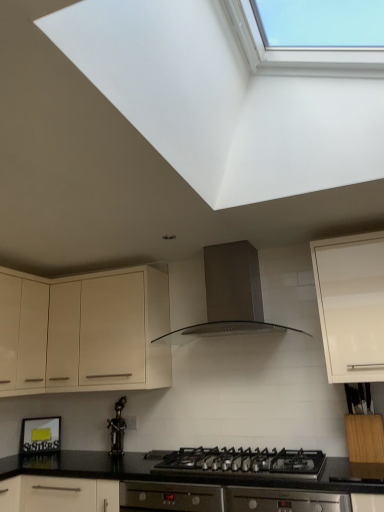
What is the approximate width of matte cream cabinet at upper left, positioned as the 1th cabinetry in back-to-front order?

It is 15.52 inches.

Image resolution: width=384 pixels, height=512 pixels. What do you see at coordinates (244, 462) in the screenshot?
I see `black matte gas stove at center` at bounding box center [244, 462].

What do you see at coordinates (117, 429) in the screenshot?
I see `bronze statue at center` at bounding box center [117, 429].

Find the location of `matte cream cabinet at upper left, positioned as the 1th cabinetry in back-to-front order`. matte cream cabinet at upper left, positioned as the 1th cabinetry in back-to-front order is located at coordinates (83, 332).

Is satin silver range hood at center not near bronze statue at center?

satin silver range hood at center is far away from bronze statue at center.

Is satin silver range hood at center taller or shorter than bronze statue at center?

Considering their sizes, satin silver range hood at center has more height than bronze statue at center.

Which is behind, point (220, 267) or point (122, 397)?

The point (122, 397) is farther.

Which of these two, satin silver range hood at center or matte cream cabinet at upper left, marked as the 1th cabinetry in a left-to-right arrangement, stands taller?

Standing taller between the two is matte cream cabinet at upper left, marked as the 1th cabinetry in a left-to-right arrangement.

Considering the relative sizes of satin silver range hood at center and matte cream cabinet at upper left, the 2th cabinetry viewed from the front, in the image provided, is satin silver range hood at center wider than matte cream cabinet at upper left, the 2th cabinetry viewed from the front,?

Yes.

Can we say satin silver range hood at center lies outside matte cream cabinet at upper left, positioned as the 1th cabinetry in back-to-front order?

Yes, satin silver range hood at center is outside of matte cream cabinet at upper left, positioned as the 1th cabinetry in back-to-front order.

In the scene shown: Between satin silver range hood at center and matte cream cabinet at upper left, marked as the 1th cabinetry in a left-to-right arrangement, which one is positioned in front?

satin silver range hood at center is in front.

Is matte cream cabinet at upper left, the 2th cabinetry viewed from the front, completely or partially inside bronze statue at center?

No, matte cream cabinet at upper left, the 2th cabinetry viewed from the front, is not a part of bronze statue at center.

Considering the sizes of objects bronze statue at center and matte cream cabinet at upper left, positioned as the 1th cabinetry in back-to-front order, in the image provided, who is smaller, bronze statue at center or matte cream cabinet at upper left, positioned as the 1th cabinetry in back-to-front order,?

Smaller between the two is bronze statue at center.

In the scene shown: Could you tell me if bronze statue at center is facing matte cream cabinet at upper left, the 2th cabinetry viewed from the front?

No, bronze statue at center is not oriented towards matte cream cabinet at upper left, the 2th cabinetry viewed from the front.

Is bronze statue at center directly adjacent to black matte gas stove at center?

No, bronze statue at center is not touching black matte gas stove at center.

Is bronze statue at center shorter than black matte gas stove at center?

No.

Where is `gas stove in front of the bronze statue at center`? The image size is (384, 512). gas stove in front of the bronze statue at center is located at coordinates (244, 462).

Is bronze statue at center to the left or to the right of black matte gas stove at center in the image?

In the image, bronze statue at center appears on the left side of black matte gas stove at center.

From a real-world perspective, between satin silver range hood at center and black matte gas stove at center, who is vertically lower?

black matte gas stove at center.

Is satin silver range hood at center in contact with black matte gas stove at center?

No, satin silver range hood at center is not beside black matte gas stove at center.

Is black matte gas stove at center at the back of satin silver range hood at center?

No, satin silver range hood at center's orientation is not away from black matte gas stove at center.

Consider the image. Which is more distant, (241, 266) or (163, 460)?

Point (241, 266)

Does black matte gas stove at center lie in front of white glossy cabinet at upper right, which is counted as the 1th cabinetry, starting from the right?

Yes, black matte gas stove at center is closer to the viewer.

Between black matte gas stove at center and white glossy cabinet at upper right, which appears as the 1th cabinetry when viewed from the front, which one has more height?

Standing taller between the two is white glossy cabinet at upper right, which appears as the 1th cabinetry when viewed from the front.

In the scene shown: How far apart are black matte gas stove at center and white glossy cabinet at upper right, which appears as the 1th cabinetry when viewed from the front?

black matte gas stove at center is 30.05 inches away from white glossy cabinet at upper right, which appears as the 1th cabinetry when viewed from the front.

From the image's perspective, which one is positioned lower, matte cream cabinet at upper left, marked as the 1th cabinetry in a left-to-right arrangement, or white glossy cabinet at upper right, which ranks as the 2th cabinetry in back-to-front order?

From the image's view, matte cream cabinet at upper left, marked as the 1th cabinetry in a left-to-right arrangement, is below.

Which point is more distant from viewer, (103, 314) or (326, 263)?

The point (103, 314) is behind.

Considering the sizes of objects matte cream cabinet at upper left, arranged as the 2th cabinetry when viewed from the right, and white glossy cabinet at upper right, which ranks as the 2th cabinetry in back-to-front order, in the image provided, who is taller, matte cream cabinet at upper left, arranged as the 2th cabinetry when viewed from the right, or white glossy cabinet at upper right, which ranks as the 2th cabinetry in back-to-front order,?

With more height is white glossy cabinet at upper right, which ranks as the 2th cabinetry in back-to-front order.

Is matte cream cabinet at upper left, positioned as the 1th cabinetry in back-to-front order, next to white glossy cabinet at upper right, which ranks as the 2th cabinetry in back-to-front order?

No, matte cream cabinet at upper left, positioned as the 1th cabinetry in back-to-front order, is not next to white glossy cabinet at upper right, which ranks as the 2th cabinetry in back-to-front order.

At what (x,y) coordinates should I click in order to perform the action: click on kitchen appliance lying on the right of bronze statue at center. Please return your answer as a coordinate pair (x, y). Looking at the image, I should click on (230, 295).

From the image's perspective, which cabinetry is the 2nd one below the satin silver range hood at center? Please provide its 2D coordinates.

[(83, 332)]

Which object lies further to the anchor point bronze statue at center, black matte gas stove at center or white glossy cabinet at upper right, which is counted as the 1th cabinetry, starting from the right?

white glossy cabinet at upper right, which is counted as the 1th cabinetry, starting from the right, is further to bronze statue at center.

Looking at the image, which one is located closer to matte cream cabinet at upper left, arranged as the 2th cabinetry when viewed from the right, satin silver range hood at center or bronze statue at center?

Among the two, bronze statue at center is located nearer to matte cream cabinet at upper left, arranged as the 2th cabinetry when viewed from the right.

Which object lies further to the anchor point bronze statue at center, white glossy cabinet at upper right, which is counted as the 1th cabinetry, starting from the right, or satin silver range hood at center?

white glossy cabinet at upper right, which is counted as the 1th cabinetry, starting from the right.

Estimate the real-world distances between objects in this image. Which object is further from white glossy cabinet at upper right, which is counted as the 1th cabinetry, starting from the right, matte cream cabinet at upper left, marked as the 1th cabinetry in a left-to-right arrangement, or bronze statue at center?

bronze statue at center lies further to white glossy cabinet at upper right, which is counted as the 1th cabinetry, starting from the right, than the other object.

Looking at this image, from the image, which object appears to be farther from bronze statue at center, black matte gas stove at center or matte cream cabinet at upper left, arranged as the 2th cabinetry when viewed from the right?

black matte gas stove at center is positioned further to the anchor bronze statue at center.

Considering their positions, is bronze statue at center positioned closer to black matte gas stove at center than matte cream cabinet at upper left, the 2th cabinetry viewed from the front?

matte cream cabinet at upper left, the 2th cabinetry viewed from the front, lies closer to black matte gas stove at center than the other object.

When comparing their distances from black matte gas stove at center, does white glossy cabinet at upper right, which appears as the second cabinetry when viewed from the left, or bronze statue at center seem further?

Based on the image, bronze statue at center appears to be further to black matte gas stove at center.

Considering their positions, is matte cream cabinet at upper left, arranged as the 2th cabinetry when viewed from the right, positioned further to white glossy cabinet at upper right, which appears as the second cabinetry when viewed from the left, than satin silver range hood at center?

matte cream cabinet at upper left, arranged as the 2th cabinetry when viewed from the right, lies further to white glossy cabinet at upper right, which appears as the second cabinetry when viewed from the left, than the other object.

I want to click on kitchen appliance situated between bronze statue at center and white glossy cabinet at upper right, which is counted as the 1th cabinetry, starting from the right, from left to right, so tap(230, 295).

Locate an element on the screen. gas stove between satin silver range hood at center and bronze statue at center from top to bottom is located at coordinates (244, 462).

I want to click on gas stove between bronze statue at center and white glossy cabinet at upper right, which appears as the 1th cabinetry when viewed from the front, in the horizontal direction, so click(x=244, y=462).

The image size is (384, 512). I want to click on appliance between matte cream cabinet at upper left, the 2th cabinetry viewed from the front, and black matte gas stove at center, so click(x=117, y=429).